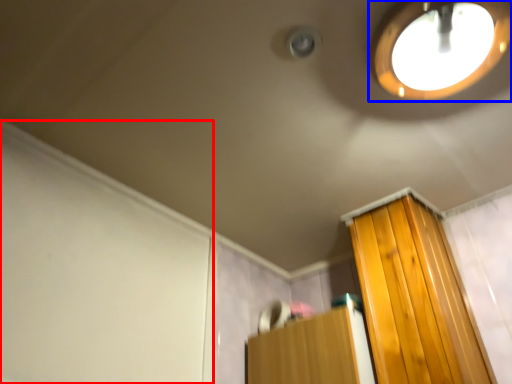
Question: Which of the following is the closest to the observer, screen door (highlighted by a red box) or droplight (highlighted by a blue box)?

Choices:
 (A) screen door
 (B) droplight

Answer: (B)